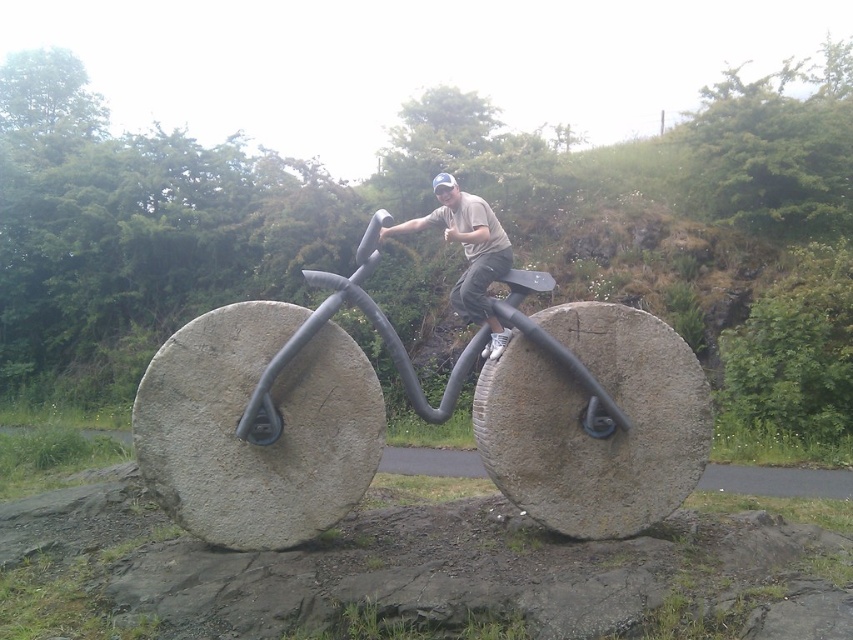
Can you confirm if gray stone bicycle at center is smaller than matte gray bicycle at center?

Actually, gray stone bicycle at center might be larger than matte gray bicycle at center.

Based on the photo, which of these two, gray stone bicycle at center or matte gray bicycle at center, stands shorter?

Standing shorter between the two is matte gray bicycle at center.

Locate an element on the screen. gray stone bicycle at center is located at coordinates (271, 413).